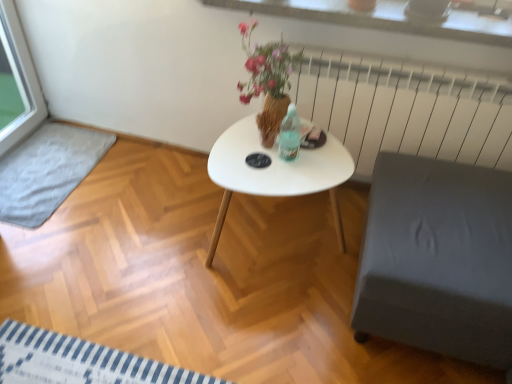
Where is `free point below white matte coffee table at center (from a real-world perspective)`? Image resolution: width=512 pixels, height=384 pixels. free point below white matte coffee table at center (from a real-world perspective) is located at coordinates (278, 240).